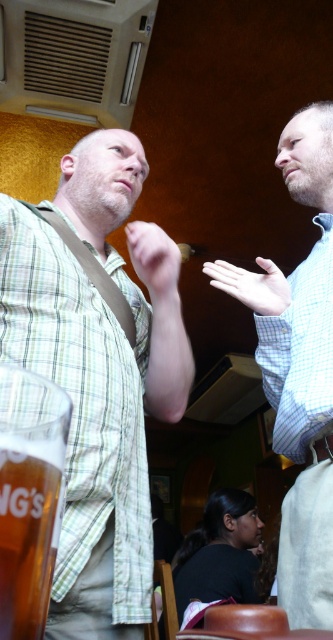
Can you confirm if green plaid shirt at center is smaller than translucent glass mug at lower left?

Actually, green plaid shirt at center might be larger than translucent glass mug at lower left.

Between green plaid shirt at center and translucent glass mug at lower left, which one appears on the left side from the viewer's perspective?

green plaid shirt at center

Find the location of a particular element. green plaid shirt at center is located at coordinates (97, 374).

Which is in front, point (91, 620) or point (292, 280)?

Point (91, 620) is more forward.

Where is `green plaid shirt at center`? This screenshot has height=640, width=333. green plaid shirt at center is located at coordinates (97, 374).

Which is below, blue checkered shirt at upper right or translucent glass mug at lower left?

translucent glass mug at lower left is below.

Does blue checkered shirt at upper right lie in front of translucent glass mug at lower left?

No, it is behind translucent glass mug at lower left.

The image size is (333, 640). Find the location of `blue checkered shirt at upper right`. blue checkered shirt at upper right is located at coordinates (295, 292).